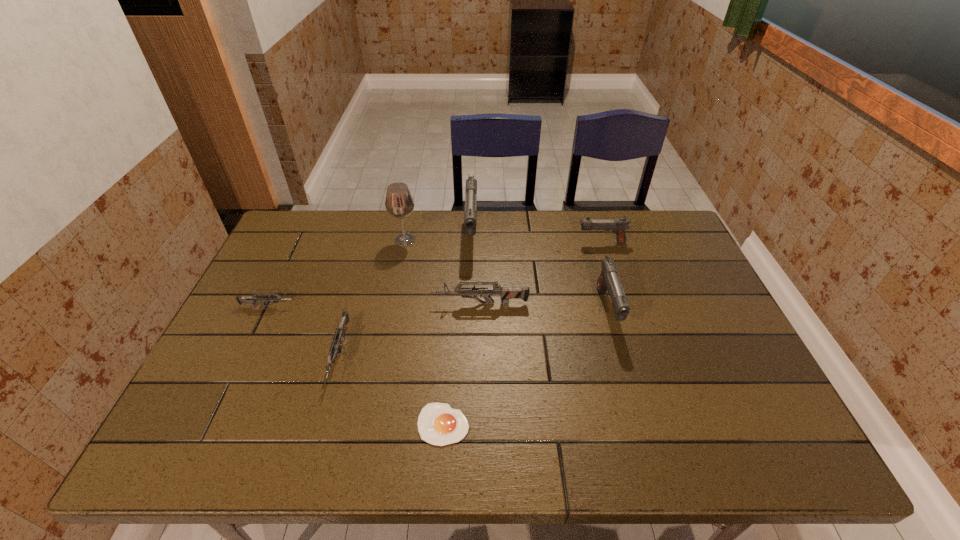
Identify which gray gun is the closest to the biggest grey gun. Please provide its 2D coordinates. Your answer should be formatted as a tuple, i.e. [(x, y)], where the tuple contains the x and y coordinates of a point satisfying the conditions above.

[(470, 214)]

Identify the location of grey gun object that ranks as the second closest to the second tallest object. This screenshot has height=540, width=960. (339, 334).

You are a GUI agent. You are given a task and a screenshot of the screen. Output one action in this format:
    pyautogui.click(x=<x>, y=<y>)
    Task: Click on the grey gun that is the second closest to the third shortest gun
    This screenshot has height=540, width=960.
    Given the screenshot: What is the action you would take?
    pyautogui.click(x=252, y=299)

Identify the location of free space in the image that satisfies the following two spatial constraints: 1. aimed along the barrel of the second shortest object; 2. on the left side of the egg yolk. (213, 424).

The height and width of the screenshot is (540, 960). I want to click on free space that satisfies the following two spatial constraints: 1. in the direction the fifth shortest object is aimed; 2. in the direction the nearest gray gun is aimed, so click(x=624, y=310).

Locate an element on the screen. This screenshot has height=540, width=960. vacant point that satisfies the following two spatial constraints: 1. aimed along the barrel of the biggest grey gun; 2. aimed along the barrel of the second gun from left to right is located at coordinates (481, 356).

This screenshot has height=540, width=960. I want to click on free space that satisfies the following two spatial constraints: 1. on the front side of the shortest object; 2. on the left side of the third object from left to right, so click(x=368, y=424).